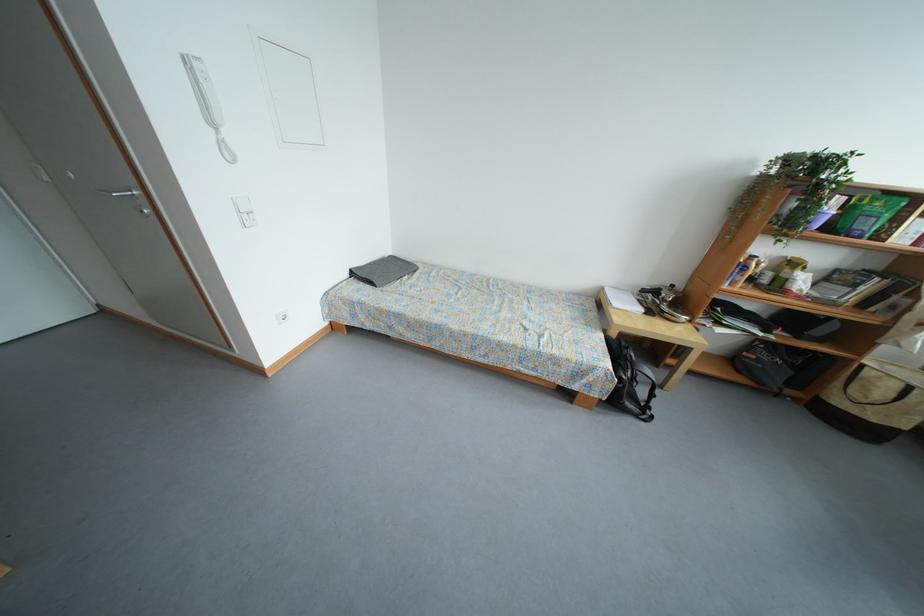
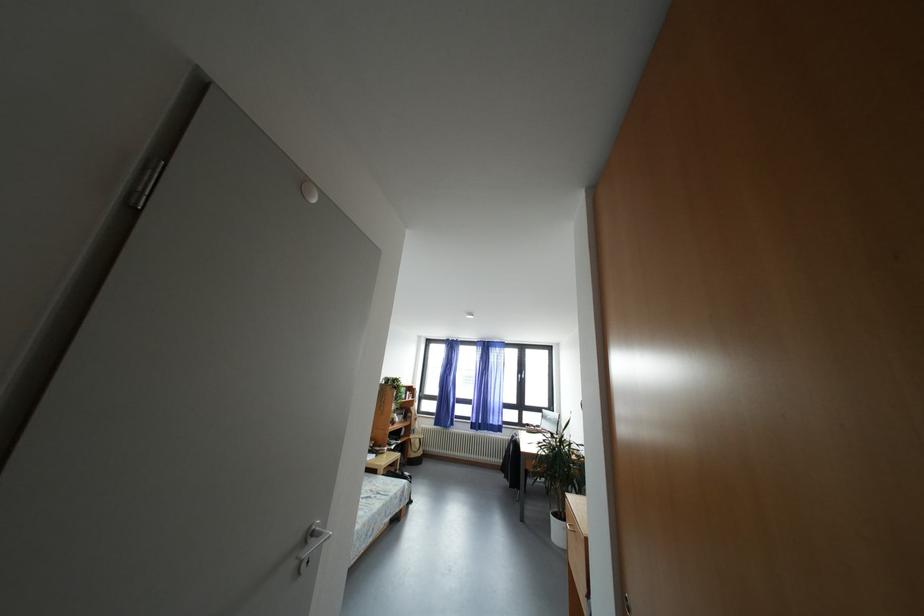
In the second image, find the point that corresponds to point 553,334 in the first image.

(378, 496)